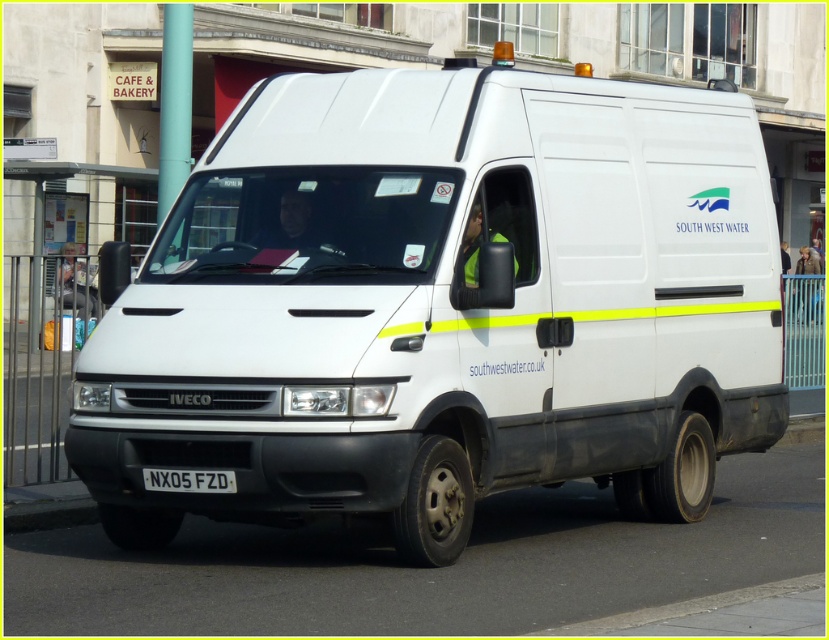
Question: Which object is closer to the camera taking this photo?

Choices:
 (A) white matte van at center
 (B) white plastic license plate at center

Answer: (A)

Question: Can you confirm if white matte van at center is positioned above white plastic license plate at center?

Choices:
 (A) no
 (B) yes

Answer: (B)

Question: Is white matte van at center to the right of white plastic license plate at center from the viewer's perspective?

Choices:
 (A) no
 (B) yes

Answer: (B)

Question: Can you confirm if white matte van at center is positioned to the right of white plastic license plate at center?

Choices:
 (A) no
 (B) yes

Answer: (B)

Question: Which object appears farthest from the camera in this image?

Choices:
 (A) white matte van at center
 (B) white plastic license plate at center

Answer: (B)